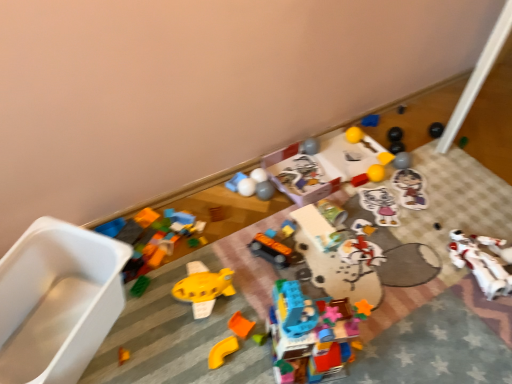
Identify the location of free region on the left part of matte plastic sticker at center, positioned as the 16th toy in left-to-right order. (367, 193).